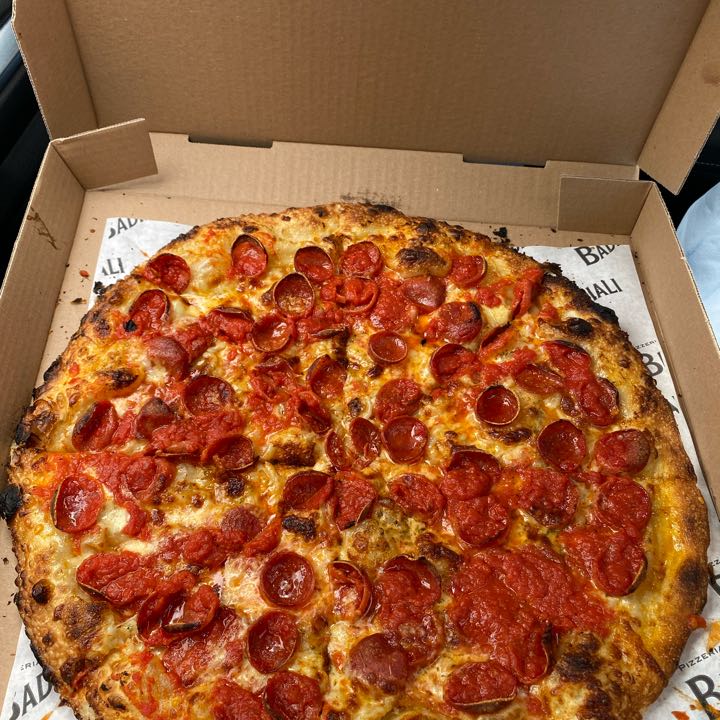
What are the coordinates of `sheet` in the screenshot? It's located at (703, 675).